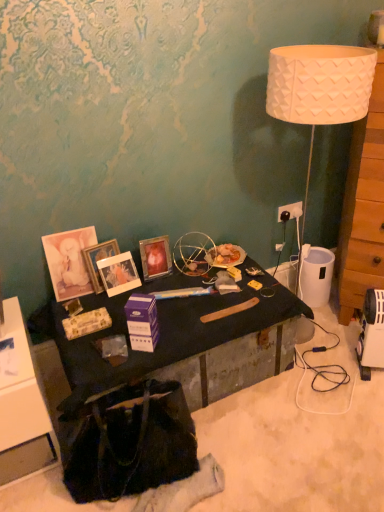
The width and height of the screenshot is (384, 512). I want to click on vacant location behind purple cardboard box at center, so coord(157,314).